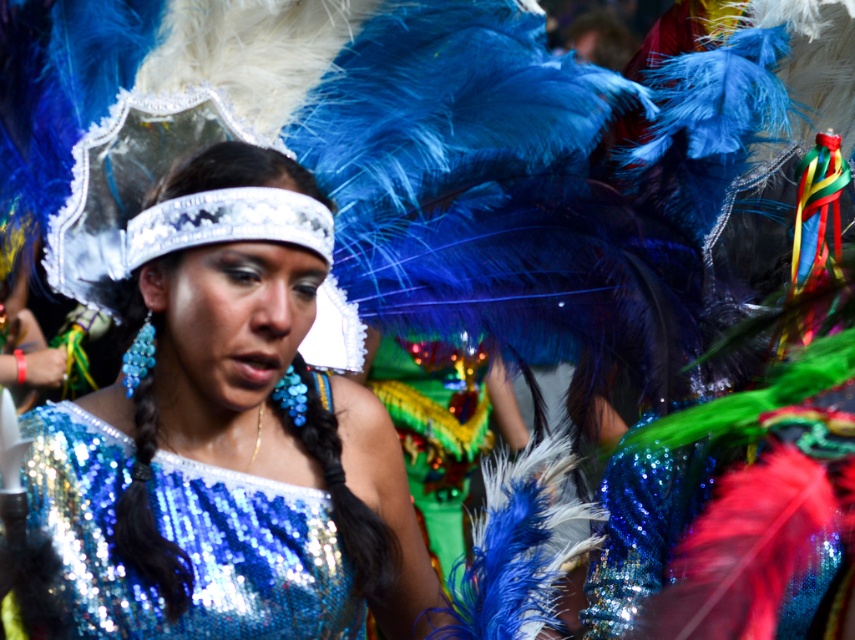
Does shiny sequined dress at center appear under shiny sequined top at center?

No.

Between shiny sequined dress at center and shiny sequined top at center, which one appears on the left side from the viewer's perspective?

shiny sequined top at center

Where is `shiny sequined dress at center`? This screenshot has height=640, width=855. shiny sequined dress at center is located at coordinates (222, 440).